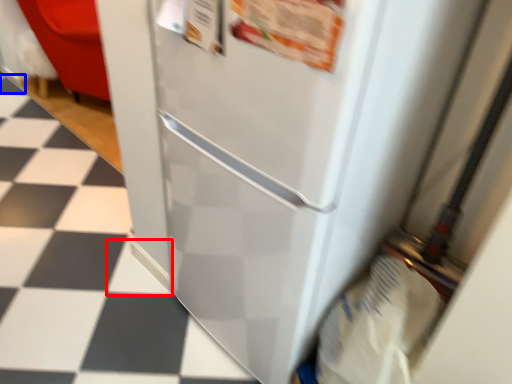
Question: Which point is closer to the camera, tile (highlighted by a red box) or tile (highlighted by a blue box)?

Choices:
 (A) tile
 (B) tile

Answer: (A)